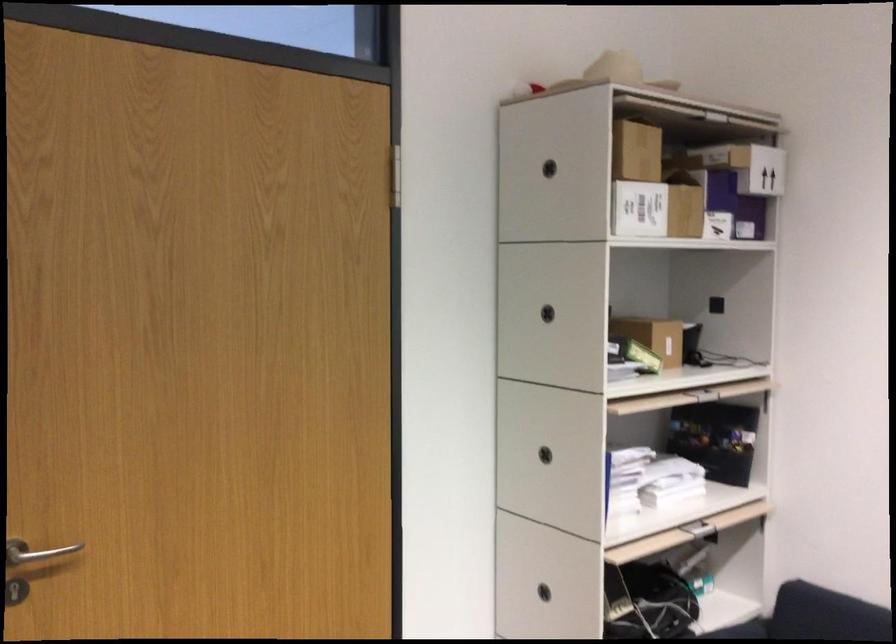
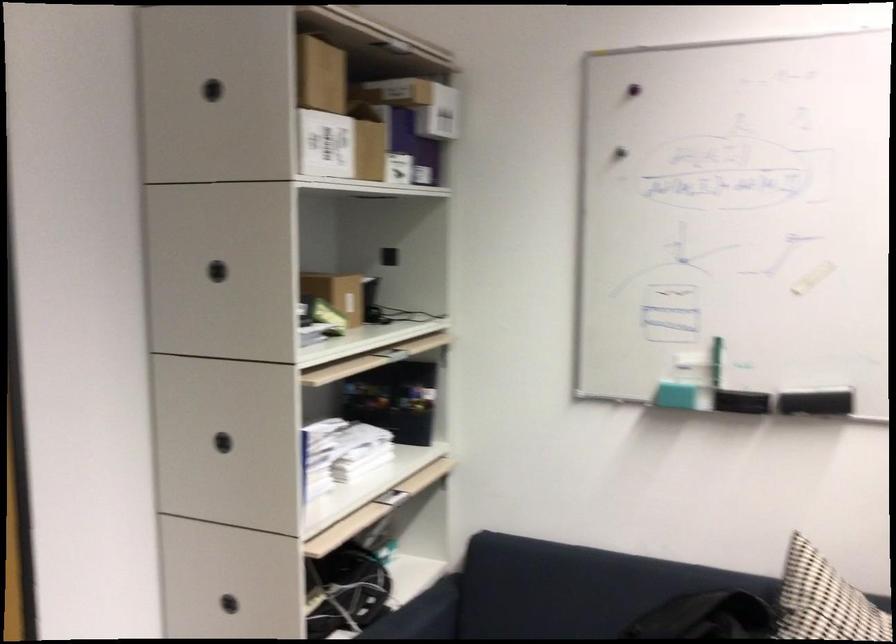
The point at [544,457] is marked in the first image. Where is the corresponding point in the second image?

(222, 442)